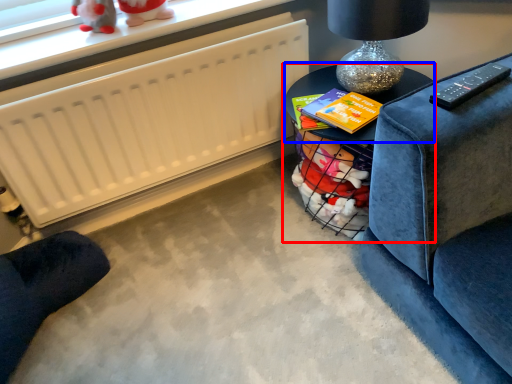
Question: Among these objects, which one is farthest to the camera, table (highlighted by a red box) or table (highlighted by a blue box)?

Choices:
 (A) table
 (B) table

Answer: (B)